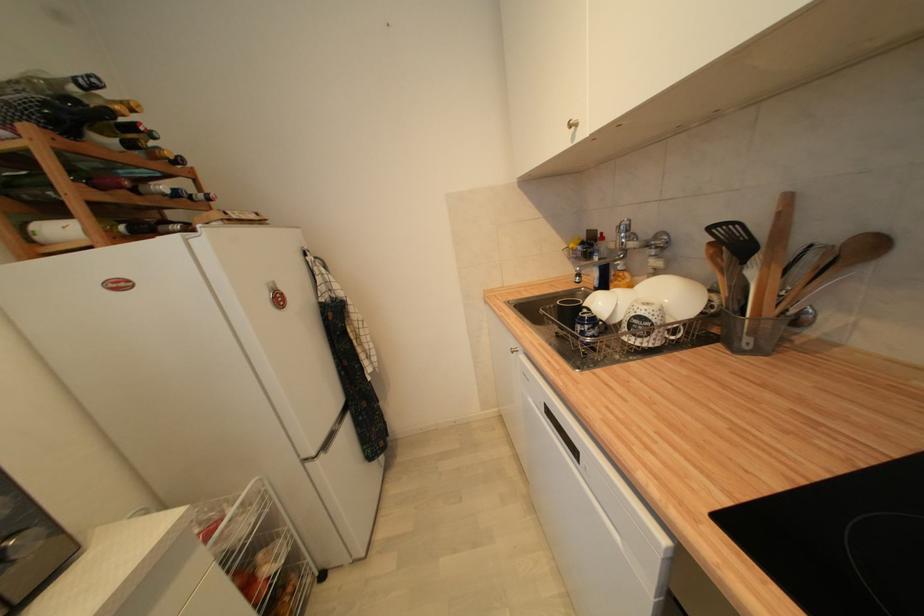
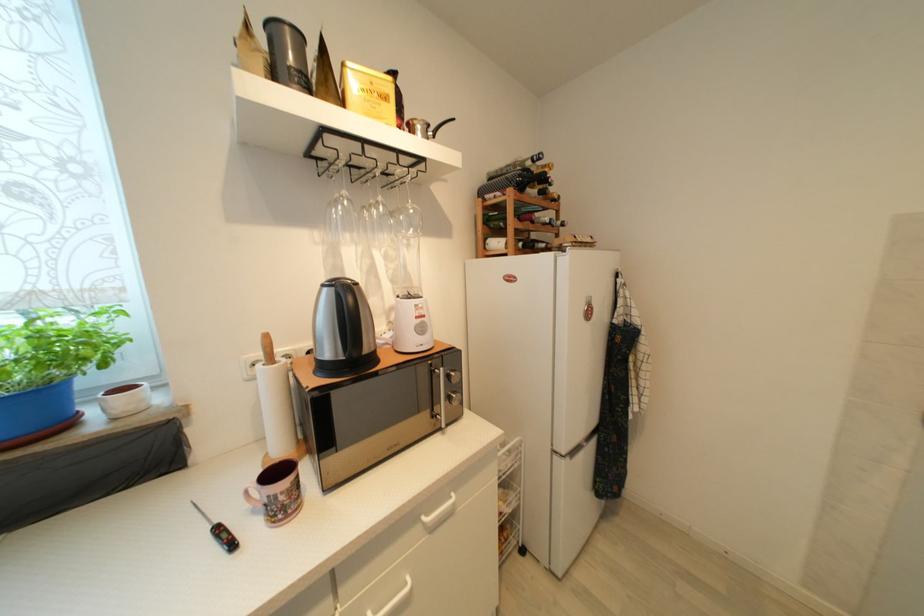
In the second image, find the point that corresponds to the point at 33,83 in the first image.

(518, 166)